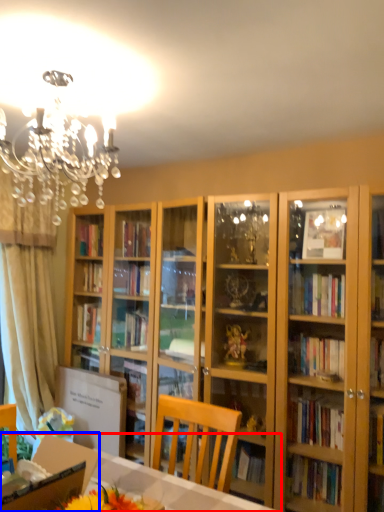
Question: Which object is closer to the camera taking this photo, desk (highlighted by a red box) or cardboard box (highlighted by a blue box)?

Choices:
 (A) desk
 (B) cardboard box

Answer: (A)